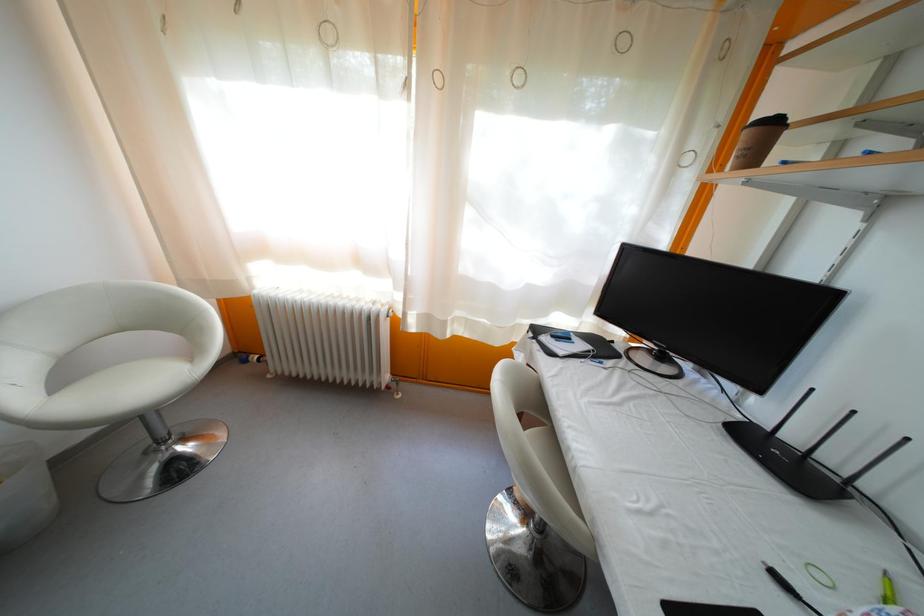
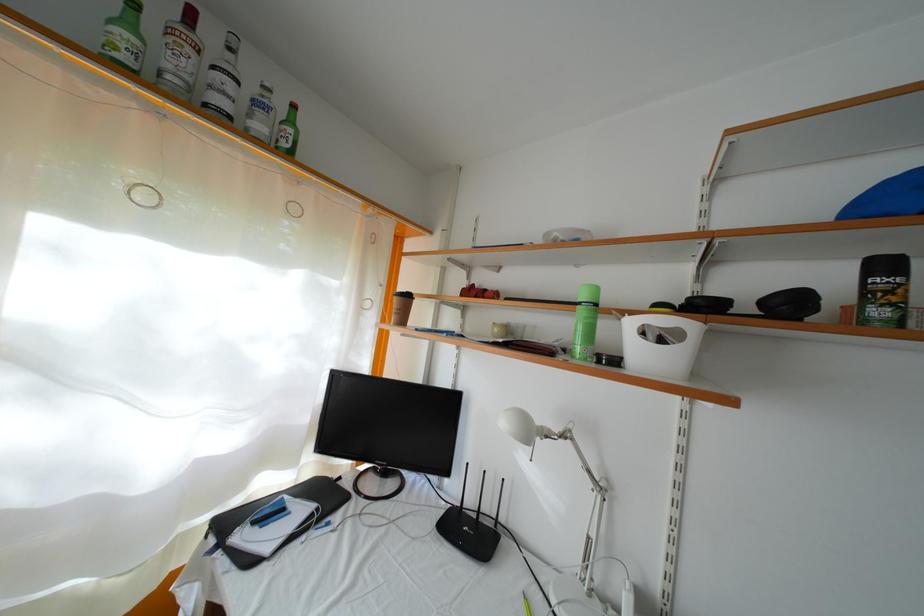
Locate, in the second image, the point that corresponds to pixel 842 485 in the first image.

(497, 531)